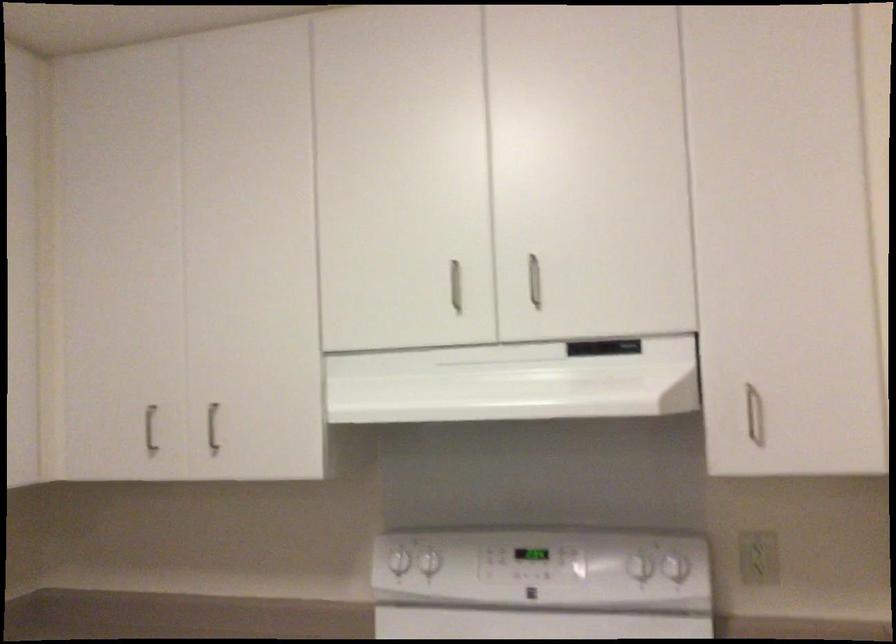
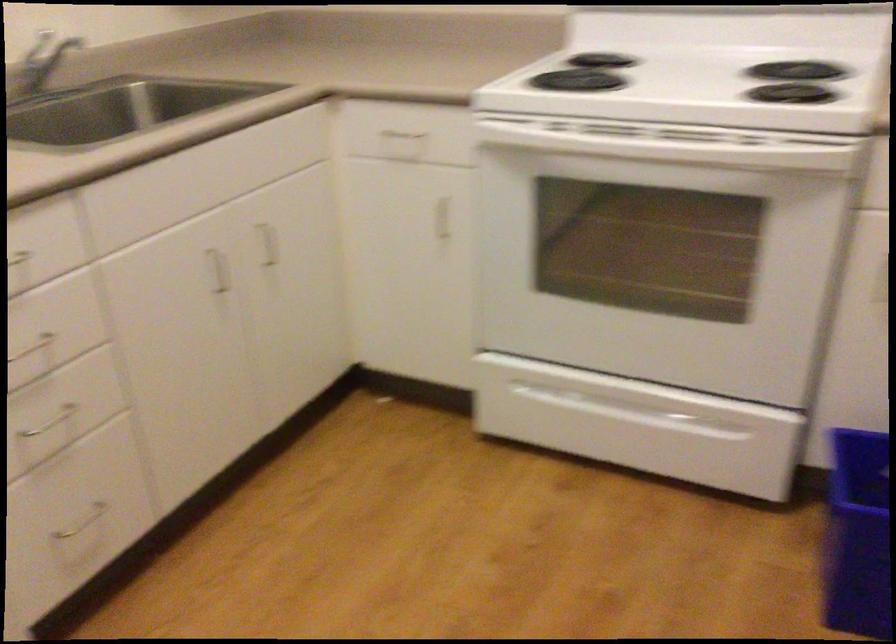
Question: The images are taken continuously from a first-person perspective. In which direction is your viewpoint rotating?

Choices:
 (A) Left
 (B) Right
 (C) Up
 (D) Down

Answer: (D)